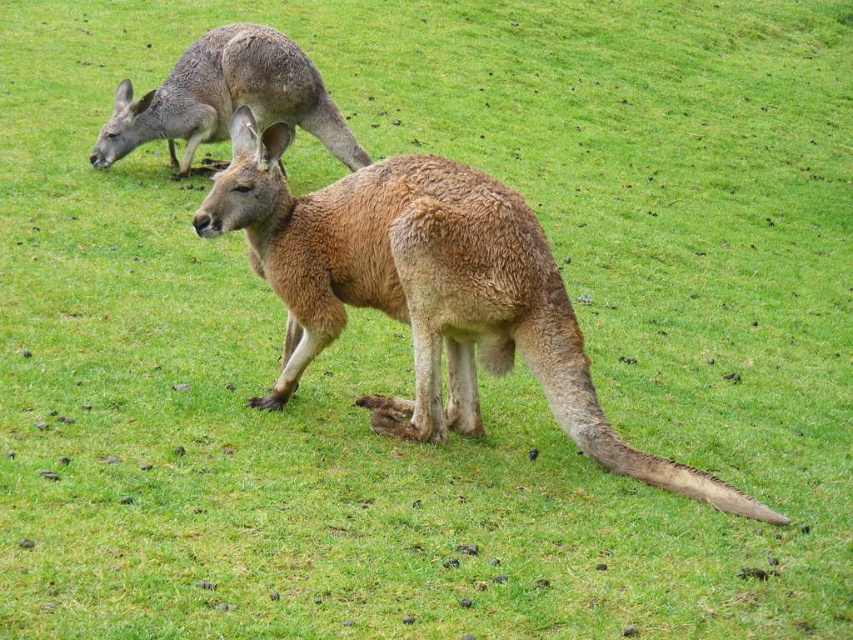
Question: Is brown furry kangaroo at center positioned behind gray fur kangaroo at upper left?

Choices:
 (A) yes
 (B) no

Answer: (B)

Question: Does brown furry kangaroo at center appear under gray fur kangaroo at upper left?

Choices:
 (A) yes
 (B) no

Answer: (A)

Question: Which of the following is the farthest from the observer?

Choices:
 (A) (207, 51)
 (B) (584, 436)

Answer: (A)

Question: Considering the relative positions of brown furry kangaroo at center and gray fur kangaroo at upper left in the image provided, where is brown furry kangaroo at center located with respect to gray fur kangaroo at upper left?

Choices:
 (A) left
 (B) right

Answer: (B)